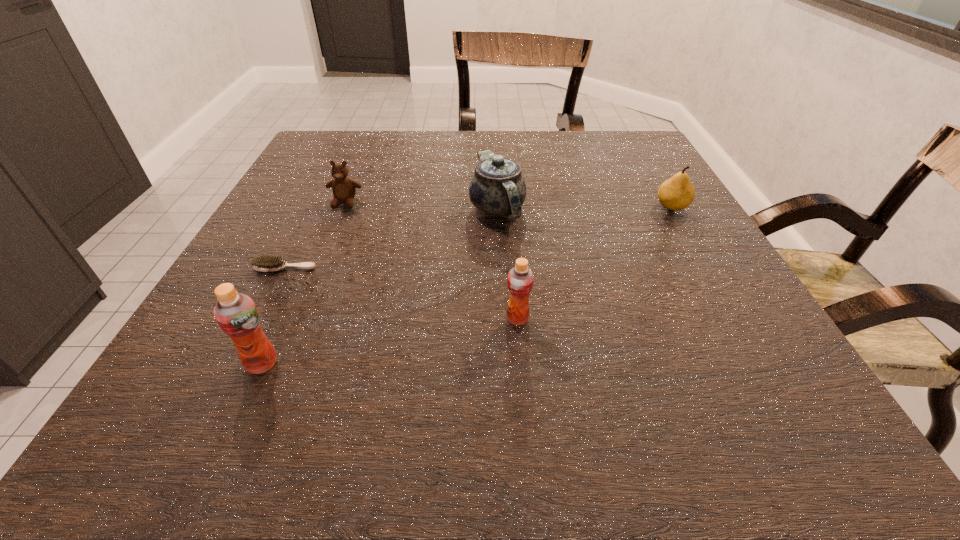
Where is `the left orange juice`? The width and height of the screenshot is (960, 540). the left orange juice is located at coordinates (236, 314).

I want to click on the taller orange juice, so click(236, 314).

Where is `the farther orange juice`? The image size is (960, 540). the farther orange juice is located at coordinates (520, 280).

This screenshot has height=540, width=960. What are the coordinates of `the second nearest object` in the screenshot? It's located at (520, 280).

Identify the location of pear. The height and width of the screenshot is (540, 960). (677, 193).

Where is `teddy bear`? Image resolution: width=960 pixels, height=540 pixels. teddy bear is located at coordinates (344, 189).

At what (x,y) coordinates should I click in order to perform the action: click on chinaware. Please return your answer as a coordinate pair (x, y). This screenshot has width=960, height=540. Looking at the image, I should click on (497, 188).

Locate an element on the screen. The image size is (960, 540). scrubbing brush is located at coordinates (267, 263).

In order to click on the shortest object in this screenshot , I will do `click(267, 263)`.

Locate an element on the screen. free space located 0.290m on the back of the nearest object is located at coordinates (320, 234).